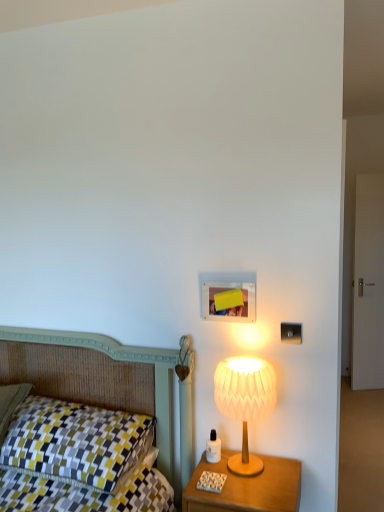
Identify the location of vacant area in front of white paper lampshade at right. The width and height of the screenshot is (384, 512). (249, 493).